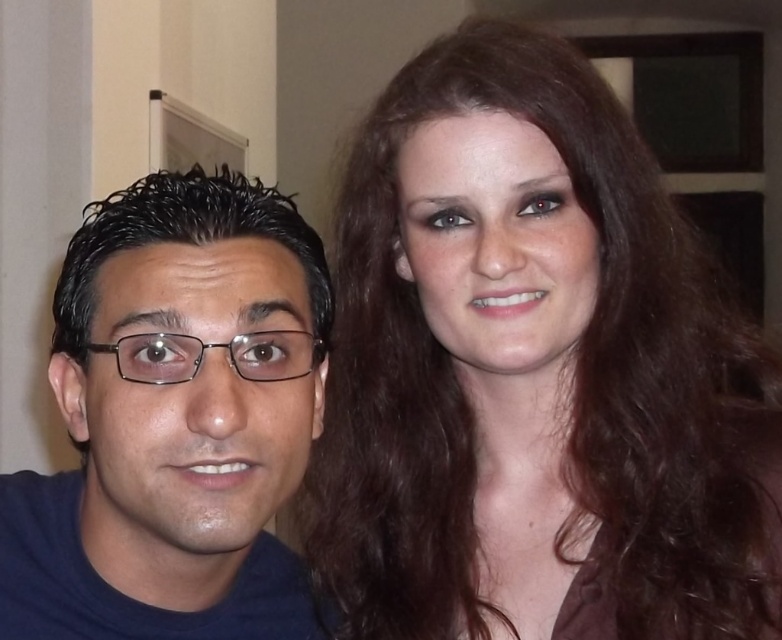
Question: Can you confirm if smooth brown hair at right is positioned below matte black glasses at left?

Choices:
 (A) no
 (B) yes

Answer: (B)

Question: Which point is closer to the camera?

Choices:
 (A) (49, 561)
 (B) (637, 509)

Answer: (B)

Question: Can you confirm if smooth brown hair at right is positioned to the right of matte black glasses at left?

Choices:
 (A) no
 (B) yes

Answer: (B)

Question: Is smooth brown hair at right smaller than matte black glasses at left?

Choices:
 (A) no
 (B) yes

Answer: (A)

Question: Which point appears closest to the camera in this image?

Choices:
 (A) (612, 472)
 (B) (178, 192)

Answer: (B)